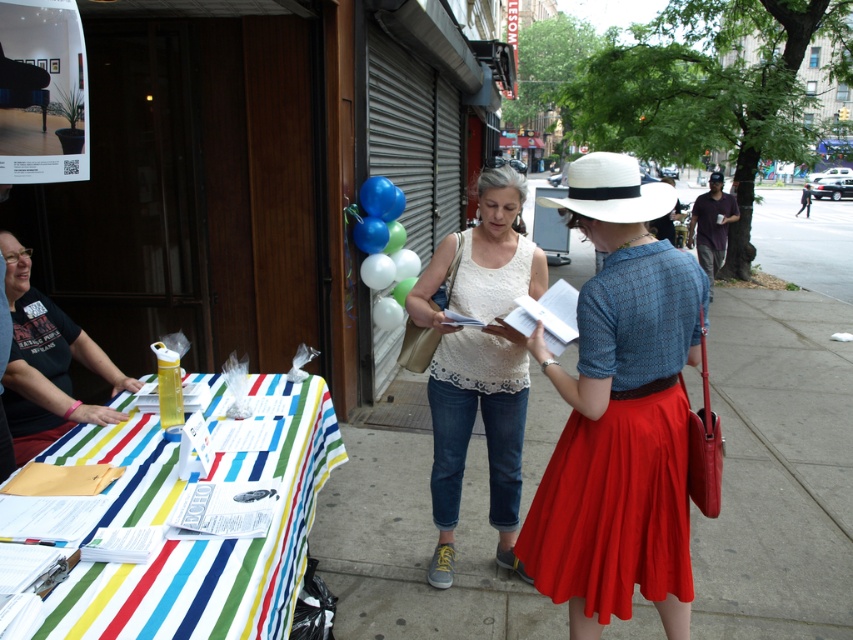
Question: Which of these objects is positioned farthest from the striped fabric table at lower left?

Choices:
 (A) dark brown leather jacket at upper right
 (B) white lace dress at center
 (C) white lace tank top at center

Answer: (A)

Question: Is white lace tank top at center smaller than dark brown leather jacket at upper right?

Choices:
 (A) no
 (B) yes

Answer: (B)

Question: Which object appears farthest from the camera in this image?

Choices:
 (A) white glossy balloons at center
 (B) striped fabric table at lower left

Answer: (A)

Question: Is matte blue blouse at center behind white lace tank top at center?

Choices:
 (A) no
 (B) yes

Answer: (A)

Question: Among these points, which one is nearest to the camera?

Choices:
 (A) (556, 595)
 (B) (514, 368)

Answer: (A)

Question: Does smooth concrete sidewalk at center appear on the right side of white glossy balloons at center?

Choices:
 (A) yes
 (B) no

Answer: (B)